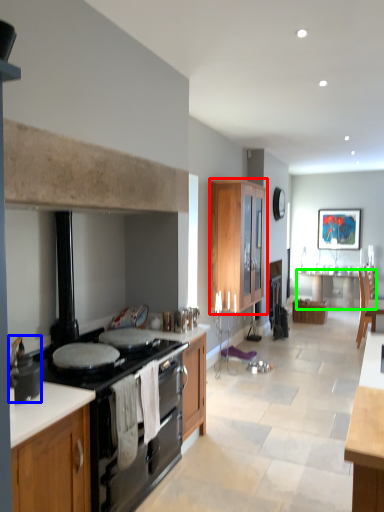
Question: Considering the real-world distances, which object is closest to cabinetry (highlighted by a red box)? pot/pan (highlighted by a blue box) or table (highlighted by a green box).

Choices:
 (A) pot/pan
 (B) table

Answer: (B)